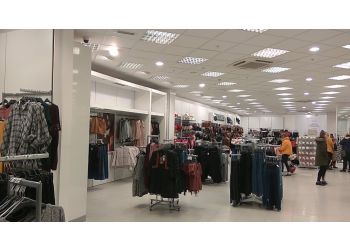
Where is `wall`? This screenshot has height=250, width=350. wall is located at coordinates (191, 106).